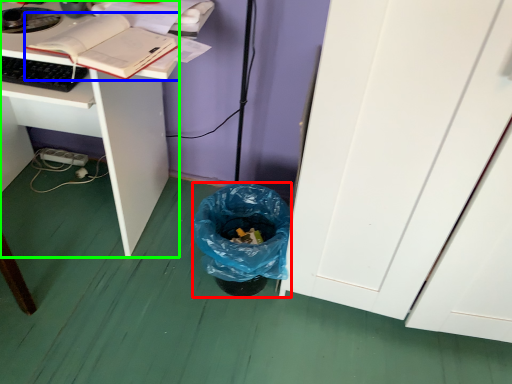
Question: Which is nearer to the trash bin/can (highlighted by a red box)? book (highlighted by a blue box) or desk (highlighted by a green box).

Choices:
 (A) book
 (B) desk

Answer: (B)